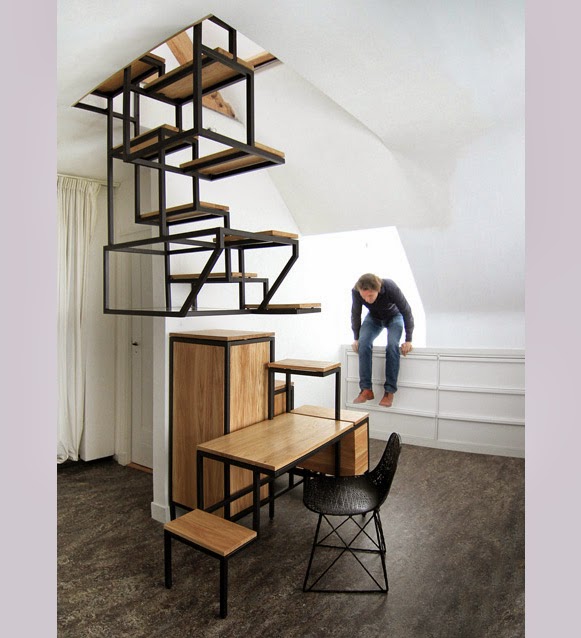
Find the location of a particular element. Image resolution: width=581 pixels, height=638 pixels. curtain is located at coordinates (67, 408).